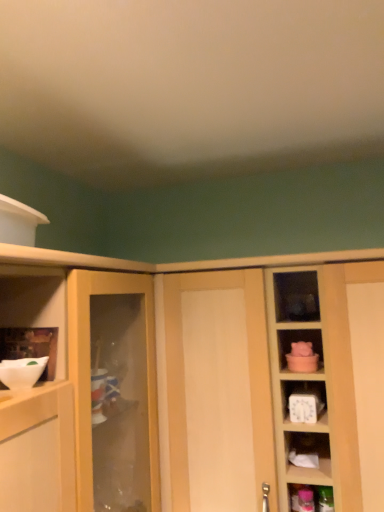
Question: Which is correct: white glossy bowl at left is inside white matte mixing bowl at left, or outside of it?

Choices:
 (A) outside
 (B) inside

Answer: (A)

Question: From the image's perspective, relative to white matte mixing bowl at left, is white glossy bowl at left above or below?

Choices:
 (A) above
 (B) below

Answer: (A)

Question: Which object is positioned farthest from the light wood cabinet at center?

Choices:
 (A) white glossy bowl at left
 (B) white matte mixing bowl at left

Answer: (B)

Question: Which is farther from the white matte mixing bowl at left?

Choices:
 (A) light wood cabinet at center
 (B) white glossy bowl at left

Answer: (A)